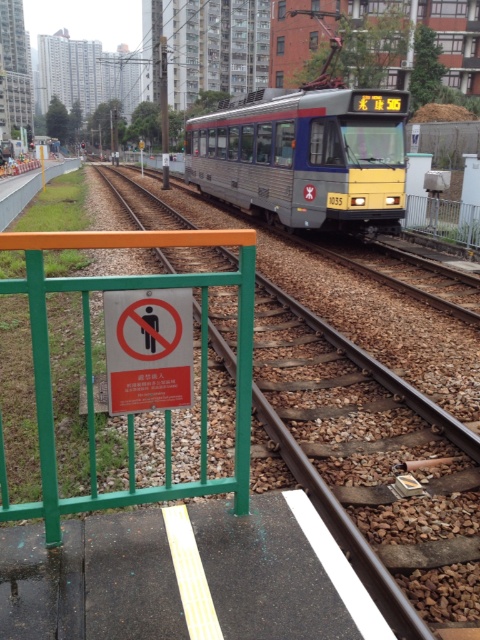
You are a maintenance worker standing on the platform and need to inspect both the brown gravel train track at center and the green metal fence at right. Which object is located lower relative to the other?

The brown gravel train track at center is located below the green metal fence at right, so it is lower than the fence.

You are a train engineer preparing to board the metallic silver train at center. As you approach the brown gravel train track at center, you notice something about their heights. Which one is taller?

The metallic silver train at center is taller than the brown gravel train track at center.